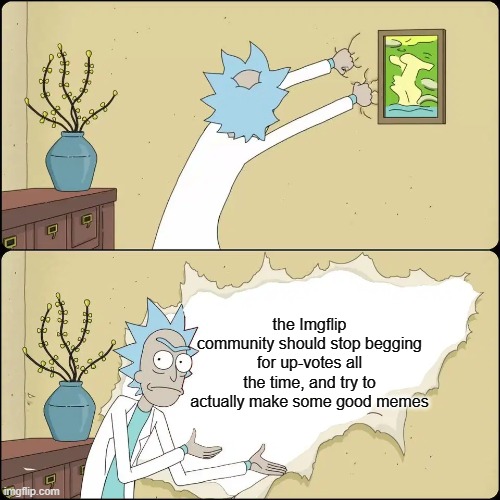
What are the coordinates of `bottom screen yellow wall` in the screenshot? It's located at (123, 277).